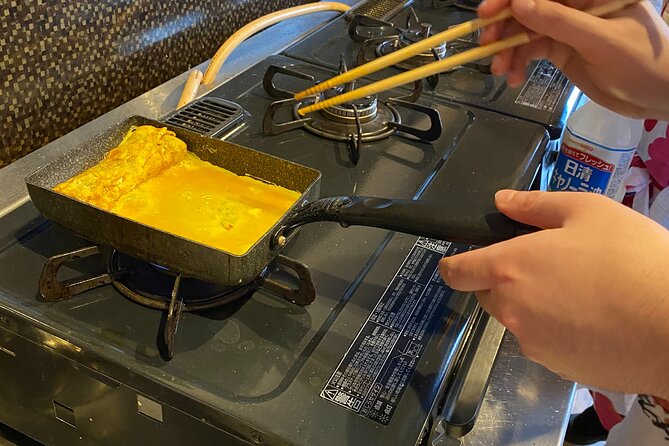
Identify the location of skillet handle. The width and height of the screenshot is (669, 446). (413, 215).